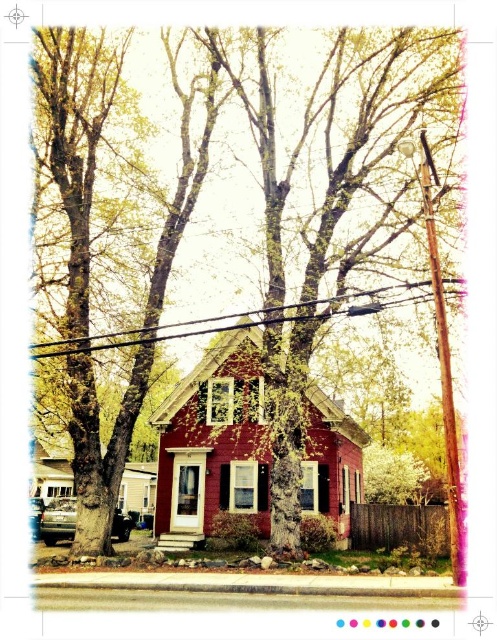
Question: In this image, where is smooth bark tree at center located relative to black wire at upper center?

Choices:
 (A) left
 (B) right

Answer: (B)

Question: Is smooth bark tree at center below black wire at upper center?

Choices:
 (A) no
 (B) yes

Answer: (B)

Question: Among these points, which one is farthest from the camera?

Choices:
 (A) (433, 288)
 (B) (200, 445)

Answer: (B)

Question: Which point appears closest to the camera in this image?

Choices:
 (A) (357, 192)
 (B) (357, 296)

Answer: (B)

Question: Observing the image, what is the correct spatial positioning of smooth bark tree at center in reference to black wire at upper center?

Choices:
 (A) above
 (B) below

Answer: (B)

Question: Which object appears farthest from the camera in this image?

Choices:
 (A) black wire at upper center
 (B) smooth bark tree at center

Answer: (B)